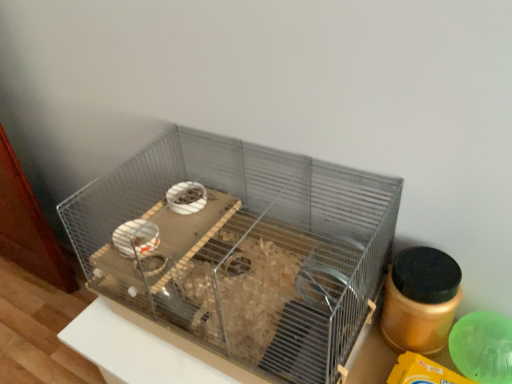
Question: In the image, is gold matte jar at right on the left side or the right side of metal wire bird cage at center?

Choices:
 (A) left
 (B) right

Answer: (B)

Question: From the image's perspective, relative to metal wire bird cage at center, is gold matte jar at right above or below?

Choices:
 (A) above
 (B) below

Answer: (B)

Question: In terms of height, does gold matte jar at right look taller or shorter compared to metal wire bird cage at center?

Choices:
 (A) tall
 (B) short

Answer: (B)

Question: From a real-world perspective, relative to gold matte jar at right, is metal wire bird cage at center vertically above or below?

Choices:
 (A) above
 (B) below

Answer: (A)

Question: From the image's perspective, is metal wire bird cage at center positioned above or below gold matte jar at right?

Choices:
 (A) below
 (B) above

Answer: (B)

Question: In the image, is metal wire bird cage at center on the left side or the right side of gold matte jar at right?

Choices:
 (A) left
 (B) right

Answer: (A)

Question: Considering their positions, is metal wire bird cage at center located in front of or behind gold matte jar at right?

Choices:
 (A) behind
 (B) front

Answer: (B)